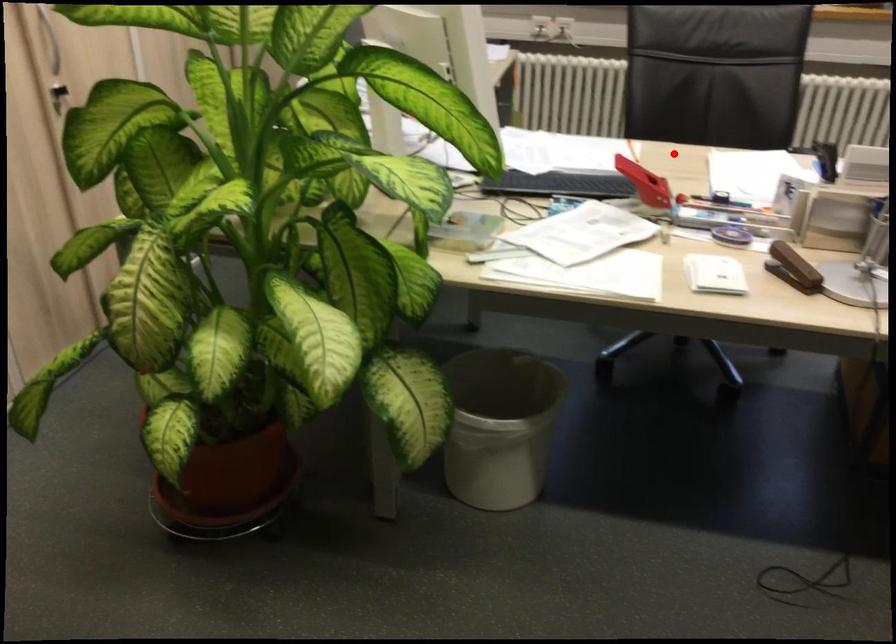
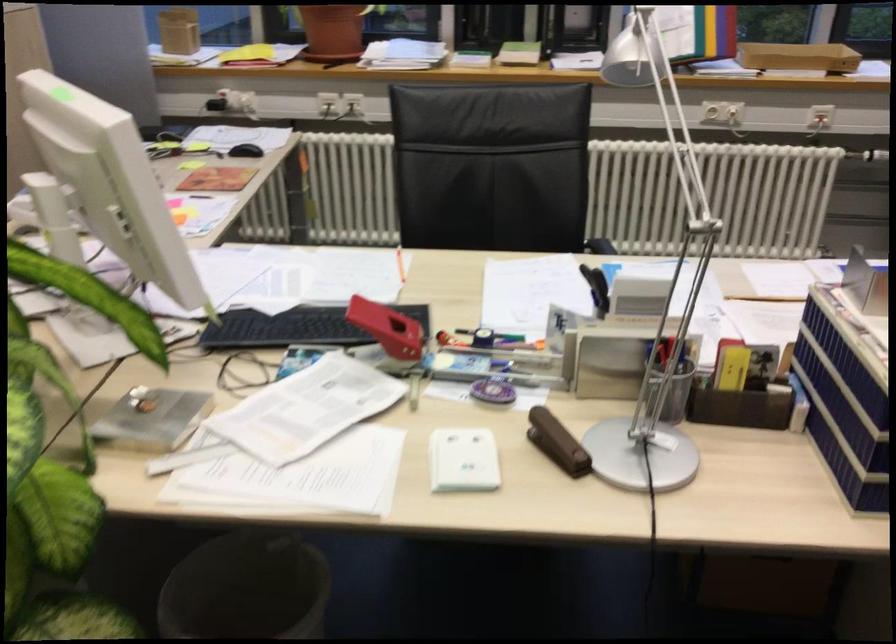
Find the pixel in the second image that matches the highlighted location in the first image.

(453, 265)